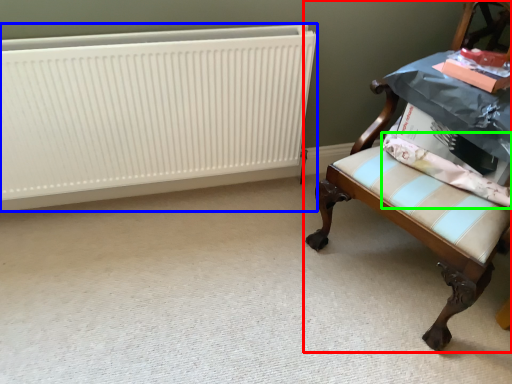
Question: Estimate the real-world distances between objects in this image. Which object is farther from chair (highlighted by a red box), radiator (highlighted by a blue box) or fabric (highlighted by a green box)?

Choices:
 (A) radiator
 (B) fabric

Answer: (A)